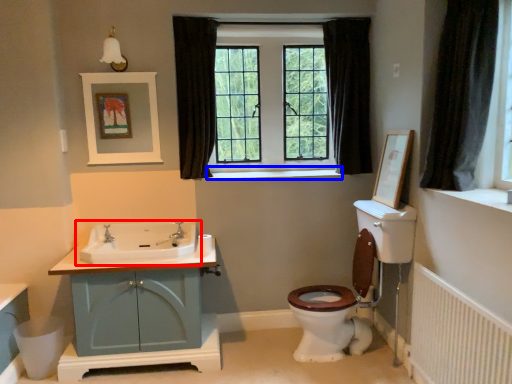
Question: Which object appears farthest to the camera in this image, sink (highlighted by a red box) or window sill (highlighted by a blue box)?

Choices:
 (A) sink
 (B) window sill

Answer: (B)